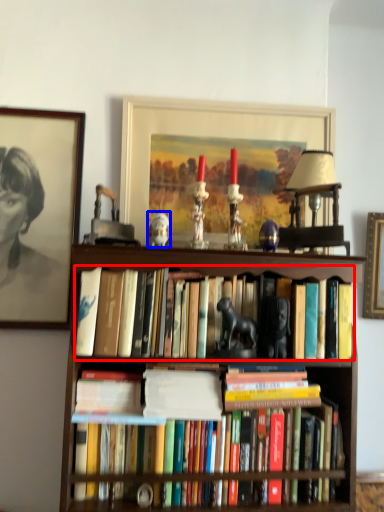
Question: Among these objects, which one is farthest to the camera, book (highlighted by a red box) or animal (highlighted by a blue box)?

Choices:
 (A) book
 (B) animal

Answer: (B)